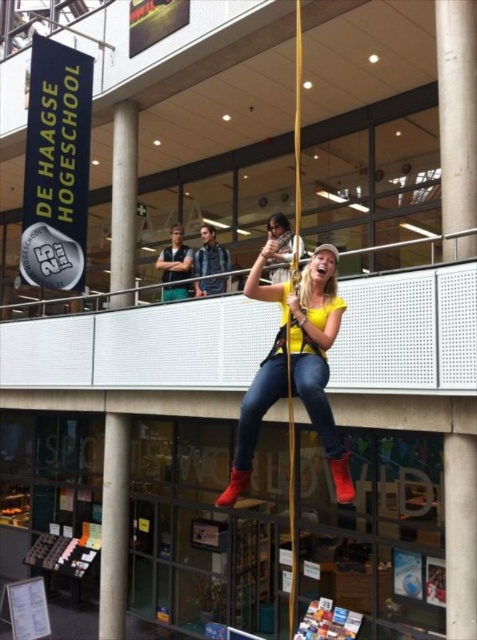
You are standing at the point with coordinates point (215, 280) and want to move towards the point with coordinates point (156, 259). Which direction should you move to reach your destination?

You should move backward to reach point (156, 259) because point (215, 280) is in front of it.